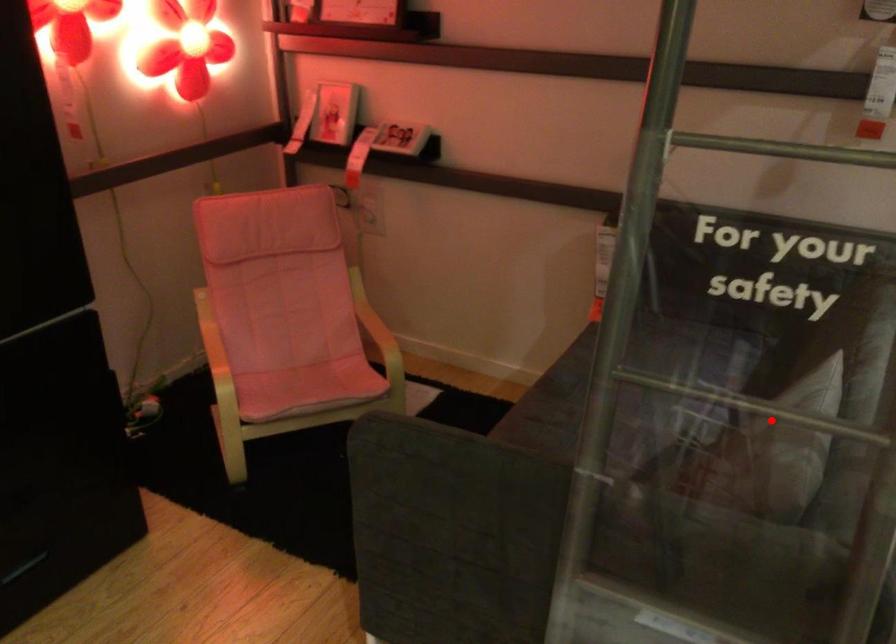
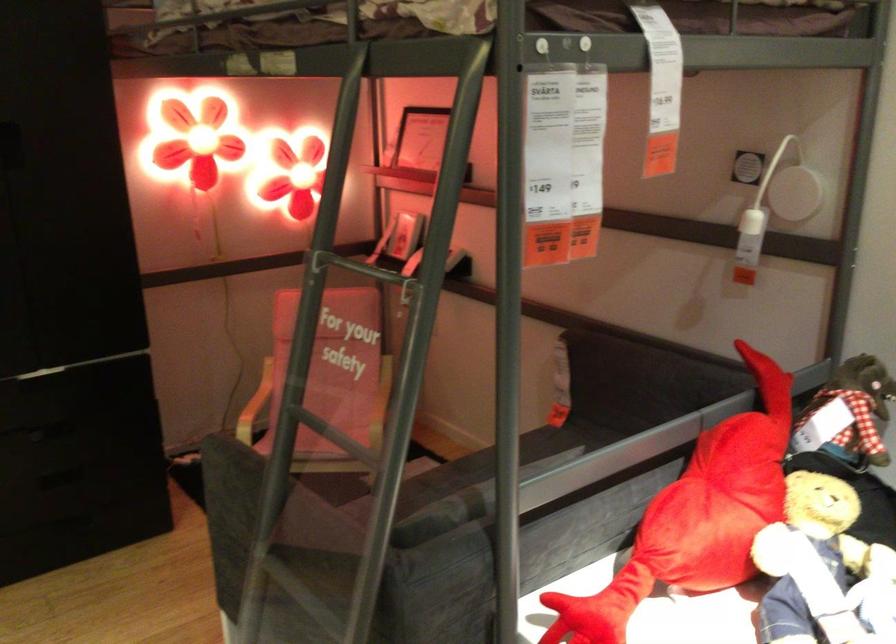
In the second image, find the point that corresponds to the highlighted location in the first image.

(340, 448)